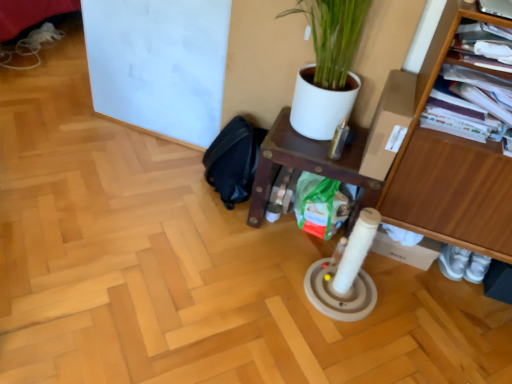
This screenshot has height=384, width=512. Find the location of `vacant space in front of black fabric swivel chair at lower center`. vacant space in front of black fabric swivel chair at lower center is located at coordinates (209, 231).